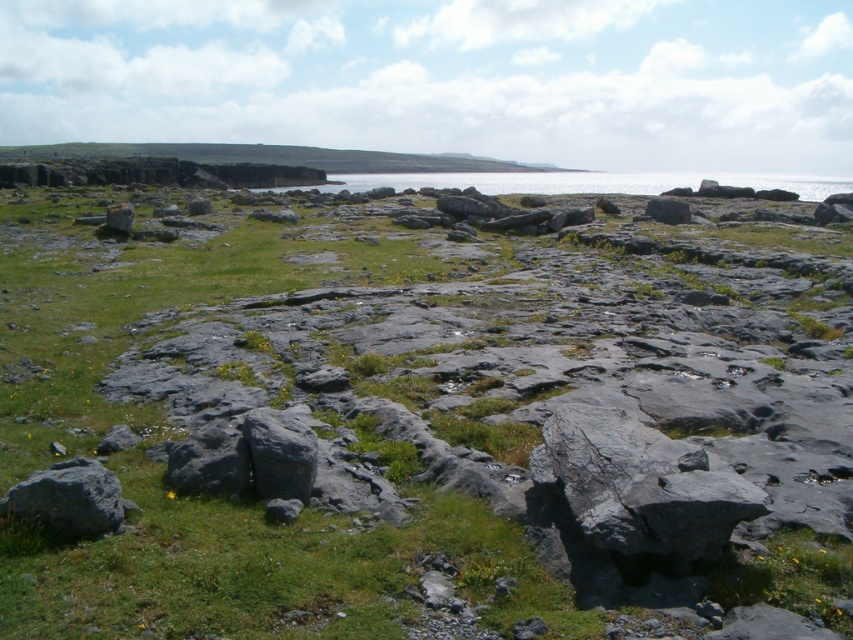
Question: Considering the real-world distances, which object is farthest from the gray rock at center?

Choices:
 (A) green grassy hillside at upper center
 (B) gray rough rock at lower left

Answer: (A)

Question: From the image, what is the correct spatial relationship of gray rock at center in relation to green grassy hillside at upper center?

Choices:
 (A) below
 (B) above

Answer: (A)

Question: Which is farther from the green grassy hillside at upper center?

Choices:
 (A) gray rough rock at lower left
 (B) gray rock at center
 (C) gray rough rock at center

Answer: (C)

Question: Does gray rock at center have a lesser width compared to gray rough rock at center?

Choices:
 (A) no
 (B) yes

Answer: (A)

Question: Which point is farther from the camera taking this photo?

Choices:
 (A) (608, 451)
 (B) (256, 438)
 (C) (408, 161)

Answer: (C)

Question: Does gray rock at center have a lesser width compared to gray rough rock at lower left?

Choices:
 (A) yes
 (B) no

Answer: (B)